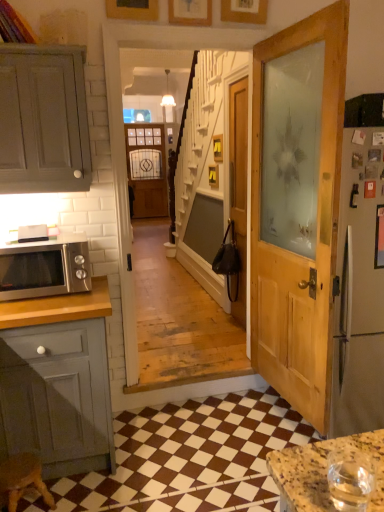
Identify the location of vacant space in brown wooden stool at lower left (from a real-world perspective). The height and width of the screenshot is (512, 384). (41, 502).